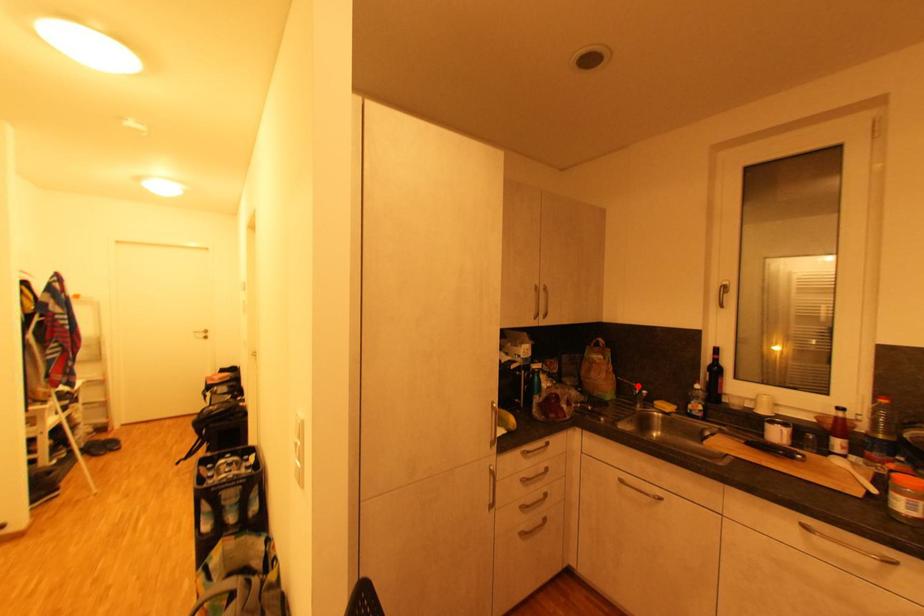
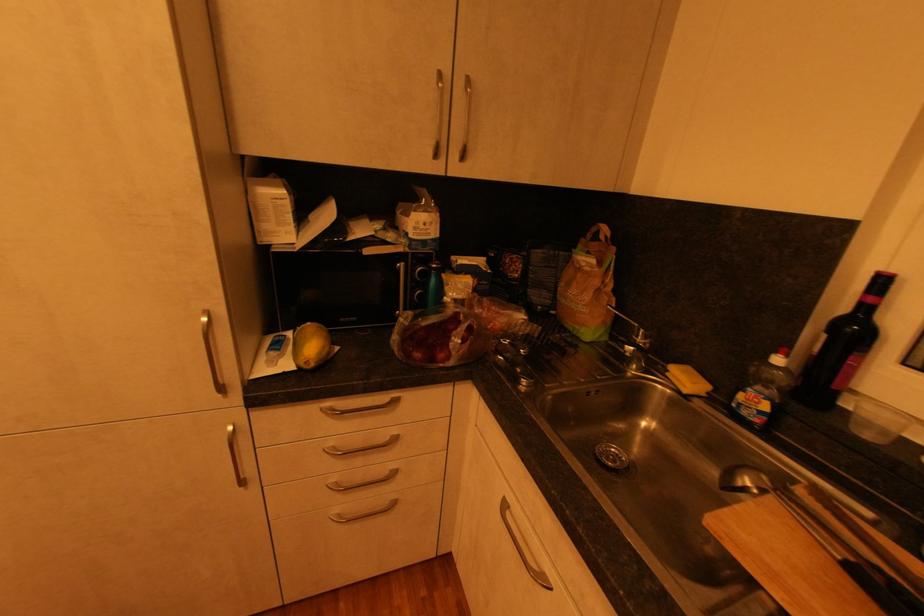
Where in the second image is the point corresponding to the highlighted location from the first image?

(638, 326)